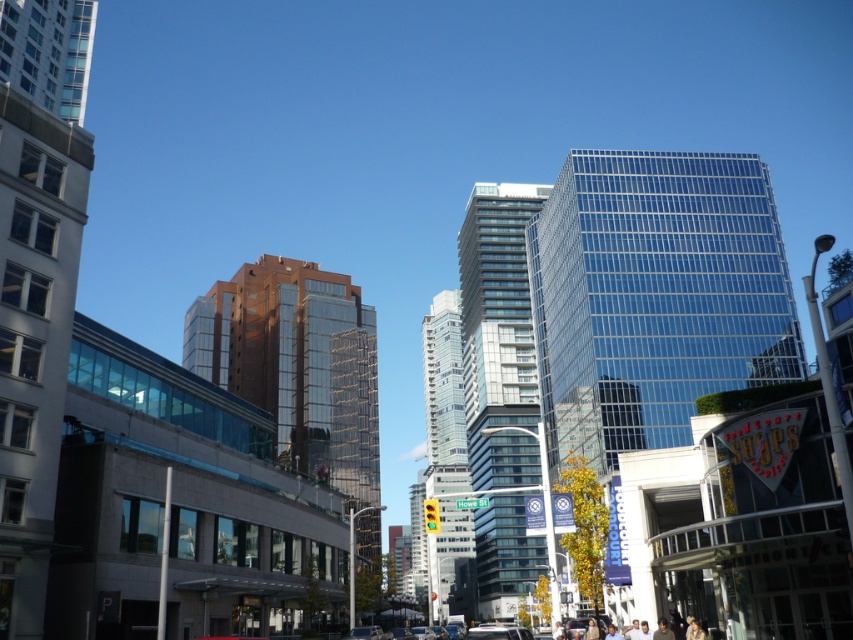
In the scene shown: Between brown glass building at center and glassy reflective building at center, which one appears on the left side from the viewer's perspective?

brown glass building at center

Based on the photo, is brown glass building at center positioned behind glassy reflective building at center?

No, brown glass building at center is in front of glassy reflective building at center.

Between point (300, 365) and point (521, 284), which one is positioned in front?

Point (300, 365)

This screenshot has width=853, height=640. Identify the location of brown glass building at center. (296, 364).

Measure the distance between point (592, 157) and camera.

118.99 meters

Is point (786, 358) farther from camera compared to point (212, 355)?

No, (786, 358) is in front of (212, 355).

In order to click on transparent glass skyscraper at center in this screenshot , I will do `click(654, 296)`.

Is transparent glass skyscraper at center thinner than glassy reflective skyscraper at center?

No, transparent glass skyscraper at center is not thinner than glassy reflective skyscraper at center.

Is transparent glass skyscraper at center in front of glassy reflective skyscraper at center?

That is True.

Who is more forward, (608, 253) or (461, 516)?

Point (608, 253) is more forward.

At what (x,y) coordinates should I click in order to perform the action: click on transparent glass skyscraper at center. Please return your answer as a coordinate pair (x, y). The image size is (853, 640). Looking at the image, I should click on (654, 296).